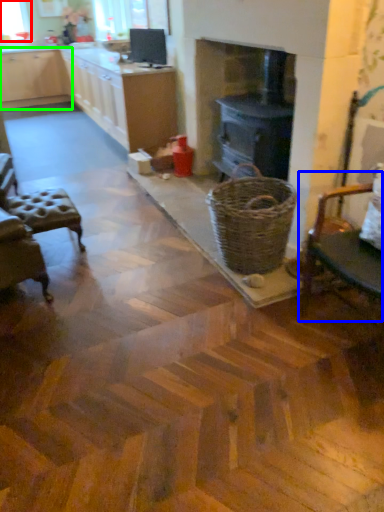
Question: Based on their relative distances, which object is farther from window screen (highlighted by a red box)? Choose from chair (highlighted by a blue box) and cabinetry (highlighted by a green box).

Choices:
 (A) chair
 (B) cabinetry

Answer: (A)